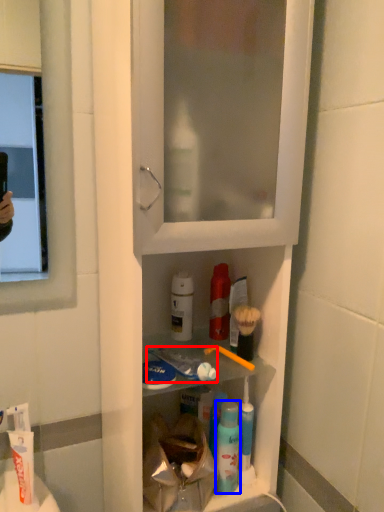
Question: Which object is further to the camera taking this photo, toothpaste (highlighted by a red box) or mouthwash (highlighted by a blue box)?

Choices:
 (A) toothpaste
 (B) mouthwash

Answer: (B)